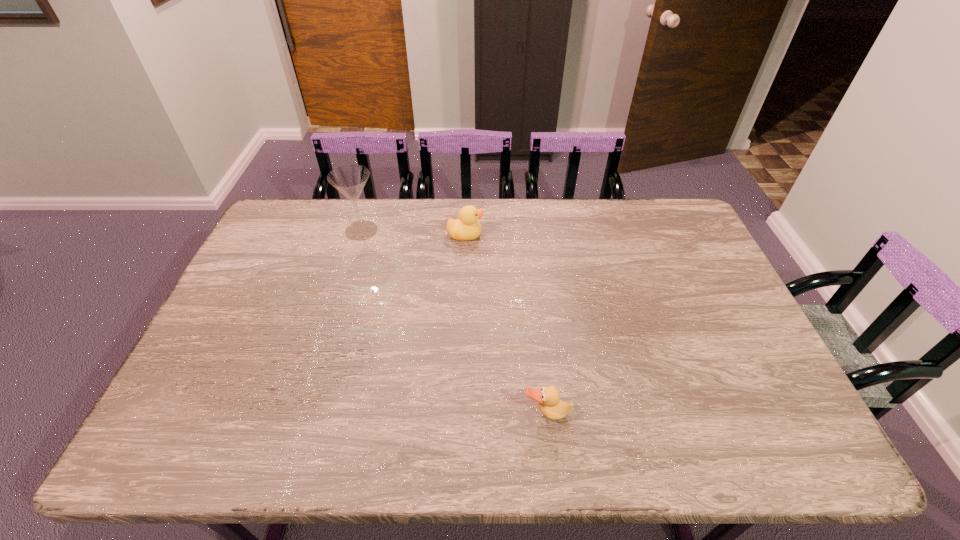
Locate an element on the screen. Image resolution: width=960 pixels, height=540 pixels. the tallest object is located at coordinates (349, 180).

Where is `flute glass`? The width and height of the screenshot is (960, 540). flute glass is located at coordinates (349, 180).

Image resolution: width=960 pixels, height=540 pixels. What are the coordinates of `the second object from right to left` in the screenshot? It's located at (467, 227).

At what (x,y) coordinates should I click in order to perform the action: click on the farther duck. Please return your answer as a coordinate pair (x, y). Looking at the image, I should click on (467, 227).

The height and width of the screenshot is (540, 960). I want to click on the nearer duck, so click(x=548, y=398).

At what (x,y) coordinates should I click in order to perform the action: click on the nearest object. Please return your answer as a coordinate pair (x, y). Looking at the image, I should click on (548, 398).

Locate an element on the screen. vacant region located 0.320m on the front of the flute glass is located at coordinates point(336,315).

This screenshot has height=540, width=960. Identify the location of vacant space located at the beak of the farther duck. (510, 235).

What are the coordinates of `blank space located 0.070m on the beak of the right duck` in the screenshot? It's located at (552, 453).

This screenshot has width=960, height=540. Find the location of `flute glass present at the far edge`. flute glass present at the far edge is located at coordinates (349, 180).